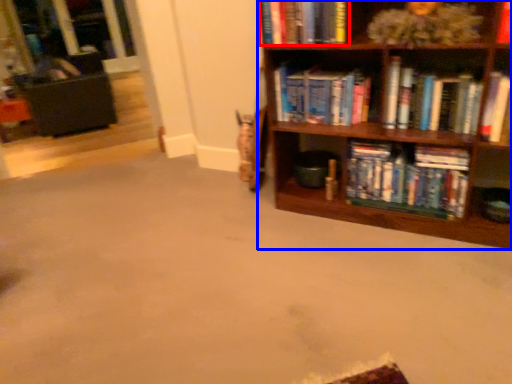
Question: Among these objects, which one is nearest to the camera, book (highlighted by a red box) or bookcase (highlighted by a blue box)?

Choices:
 (A) book
 (B) bookcase

Answer: (B)